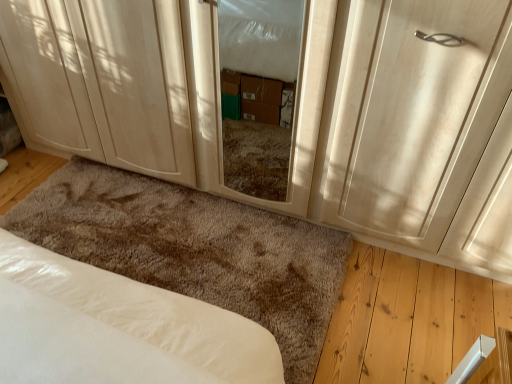
Find the location of a particular element. This screenshot has height=384, width=512. free point below matte wood door at center (from a real-world perspective) is located at coordinates (414, 254).